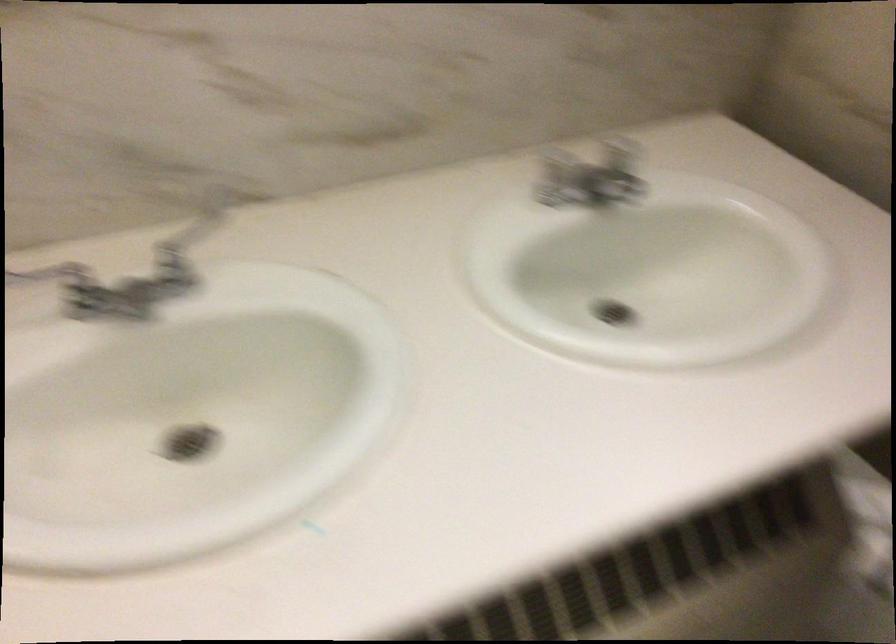
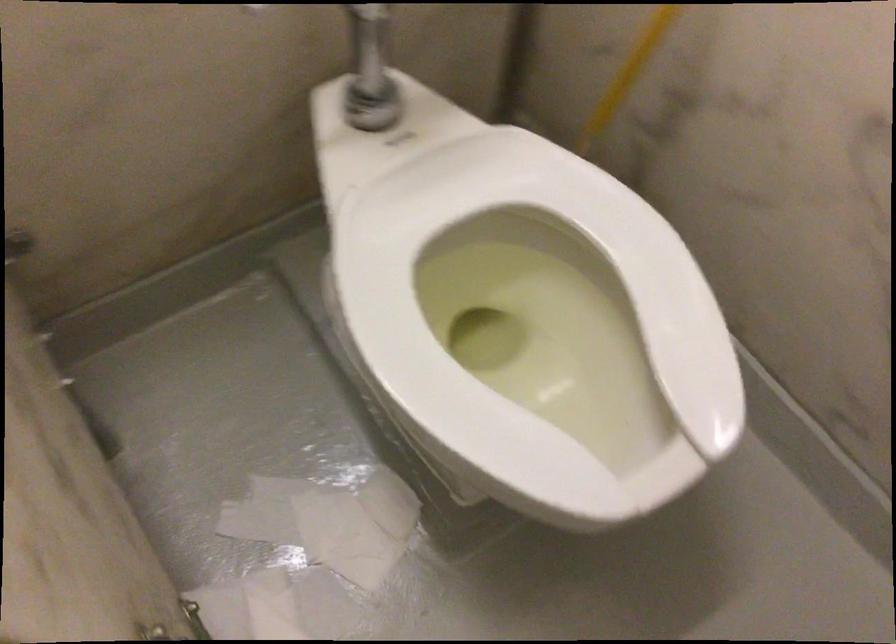
What movement of the cameraman would produce the second image?

The cameraman moved toward right, forward.